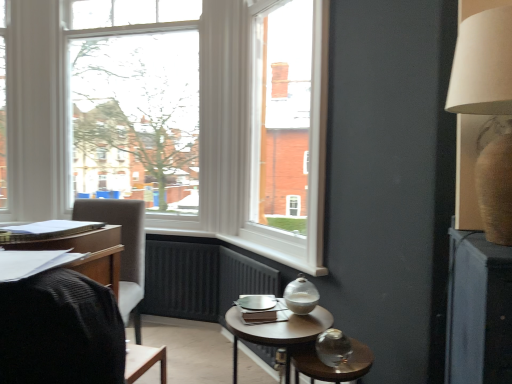
In order to face knitted fabric chair at left, should I rotate leftwards or rightwards?

Rotate your view left by about 20.880°.

This screenshot has width=512, height=384. What do you see at coordinates (332, 367) in the screenshot? I see `transparent glass table at lower right` at bounding box center [332, 367].

What are the coordinates of `clear glass window at upper left` in the screenshot? It's located at (136, 101).

Is beige fabric lampshade at upper right located outside wooden round table at center?

beige fabric lampshade at upper right is positioned outside wooden round table at center.

Considering the sizes of objects beige fabric lampshade at upper right and wooden round table at center in the image provided, who is taller, beige fabric lampshade at upper right or wooden round table at center?

beige fabric lampshade at upper right is taller.

From a real-world perspective, relative to wooden round table at center, is beige fabric lampshade at upper right vertically above or below?

From a real-world perspective, beige fabric lampshade at upper right is physically above wooden round table at center.

Which is more to the left, beige fabric lampshade at upper right or wooden round table at center?

Positioned to the left is wooden round table at center.

Do you think transparent glass table at lower right is within matte black desk at left, or outside of it?

The correct answer is: outside.

From a real-world perspective, is transparent glass table at lower right beneath matte black desk at left?

Yes, from a real-world perspective, transparent glass table at lower right is under matte black desk at left.

Identify the location of glass table below the matte black desk at left (from a real-world perspective). Image resolution: width=512 pixels, height=384 pixels. (332, 367).

Is wooden round table at center facing towards knitted fabric chair at left?

No, wooden round table at center is not facing towards knitted fabric chair at left.

Is wooden round table at center further to the viewer compared to knitted fabric chair at left?

No, it is not.

Is wooden round table at center positioned far away from knitted fabric chair at left?

No.

From the picture: Measure the distance between wooden round table at center and knitted fabric chair at left.

wooden round table at center is 25.50 inches away from knitted fabric chair at left.

In the scene shown: Considering the relative sizes of matte black desk at left and beige fabric lampshade at upper right in the image provided, is matte black desk at left bigger than beige fabric lampshade at upper right?

Actually, matte black desk at left might be smaller than beige fabric lampshade at upper right.

Is matte black desk at left placed right next to beige fabric lampshade at upper right?

No.

Do you think matte black desk at left is within beige fabric lampshade at upper right, or outside of it?

matte black desk at left cannot be found inside beige fabric lampshade at upper right.

Can you confirm if matte black desk at left is shorter than beige fabric lampshade at upper right?

Correct, matte black desk at left is not as tall as beige fabric lampshade at upper right.

Which of these two, knitted fabric chair at left or wooden round table at center, stands taller?

knitted fabric chair at left is taller.

In the scene shown: Between knitted fabric chair at left and wooden round table at center, which one has larger size?

Bigger between the two is knitted fabric chair at left.

Relative to wooden round table at center, is knitted fabric chair at left in front or behind?

knitted fabric chair at left is behind wooden round table at center.

Does knitted fabric chair at left turn towards wooden round table at center?

No, knitted fabric chair at left is not turned towards wooden round table at center.

Is clear glass window at upper left turned away from beige fabric lampshade at upper right?

That's not correct — clear glass window at upper left is not looking away from beige fabric lampshade at upper right.

Considering the sizes of objects clear glass window at upper left and beige fabric lampshade at upper right in the image provided, who is taller, clear glass window at upper left or beige fabric lampshade at upper right?

clear glass window at upper left is taller.

Would you say beige fabric lampshade at upper right is part of clear glass window at upper left's contents?

No, beige fabric lampshade at upper right is located outside of clear glass window at upper left.

From the image's perspective, is matte blue book at left on top of matte black desk at left?

Yes, from the image's perspective, matte blue book at left is over matte black desk at left.

Could you tell me if matte blue book at left is turned towards matte black desk at left?

No.

Who is smaller, matte blue book at left or matte black desk at left?

matte blue book at left.

Is matte black desk at left located within matte blue book at left?

That's incorrect, matte black desk at left is not inside matte blue book at left.

Locate an element on the screen. table located behind the beige fabric lampshade at upper right is located at coordinates (277, 332).

The image size is (512, 384). Identify the location of glass table located on the right of matte black desk at left. coord(332,367).

Looking at the image, which one is located further to beige fabric lampshade at upper right, clear glass window at upper left or matte black desk at left?

The object further to beige fabric lampshade at upper right is clear glass window at upper left.

Considering their positions, is matte blue book at left positioned further to wooden round table at center than transparent glass table at lower right?

Among the two, matte blue book at left is located further to wooden round table at center.

Considering their positions, is wooden round table at center positioned further to matte black desk at left than beige fabric lampshade at upper right?

beige fabric lampshade at upper right is positioned further to the anchor matte black desk at left.

Estimate the real-world distances between objects in this image. Which object is closer to wooden round table at center, transparent glass table at lower right or matte blue book at left?

transparent glass table at lower right lies closer to wooden round table at center than the other object.

When comparing their distances from knitted fabric chair at left, does transparent glass table at lower right or matte blue book at left seem further?

The object further to knitted fabric chair at left is transparent glass table at lower right.

Which object lies further to the anchor point matte blue book at left, transparent glass table at lower right or matte black desk at left?

transparent glass table at lower right is positioned further to the anchor matte blue book at left.

Looking at the image, which one is located closer to matte black desk at left, beige fabric lampshade at upper right or clear glass window at upper left?

The object closer to matte black desk at left is beige fabric lampshade at upper right.

Considering their positions, is matte black desk at left positioned further to wooden round table at center than matte blue book at left?

Based on the image, matte blue book at left appears to be further to wooden round table at center.

Where is `table between matte blue book at left and beige fabric lampshade at upper right in the horizontal direction`? table between matte blue book at left and beige fabric lampshade at upper right in the horizontal direction is located at coordinates (277, 332).

At what (x,y) coordinates should I click in order to perform the action: click on table between matte blue book at left and transparent glass table at lower right. Please return your answer as a coordinate pair (x, y). This screenshot has width=512, height=384. Looking at the image, I should click on [x=277, y=332].

Find the location of a particular element. This screenshot has width=512, height=384. book between wooden round table at center and clear glass window at upper left along the z-axis is located at coordinates (46, 230).

The width and height of the screenshot is (512, 384). I want to click on glass table between matte black desk at left and beige fabric lampshade at upper right, so click(x=332, y=367).